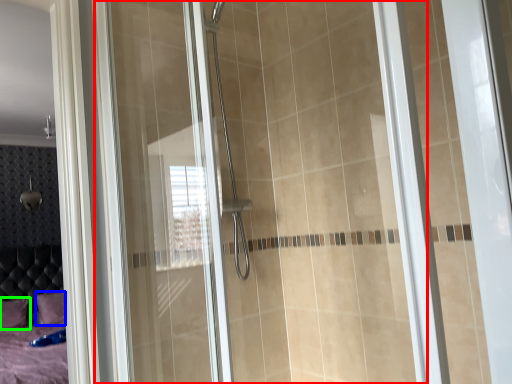
Question: Which object is the closest to the glass door (highlighted by a red box)? Choose among these: pillow (highlighted by a blue box) or pillow (highlighted by a green box).

Choices:
 (A) pillow
 (B) pillow

Answer: (A)